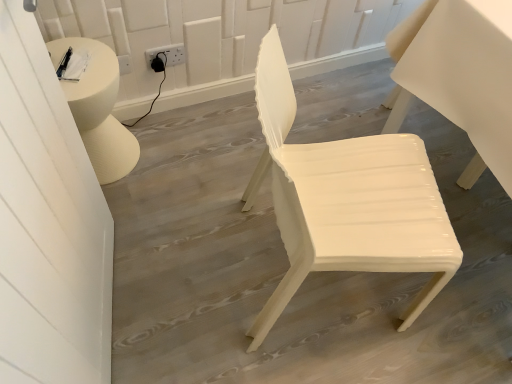
Identify the location of free spot to the right of glossy white chair at center. [x=459, y=303].